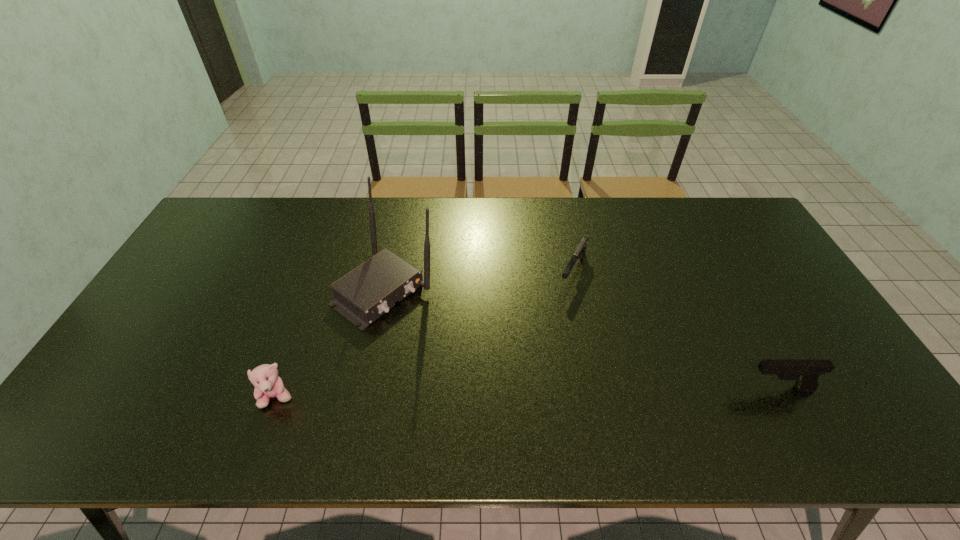
Locate an element on the screen. Image resolution: width=960 pixels, height=540 pixels. vacant space located on the back of the tallest object to connect cables is located at coordinates (468, 349).

You are a GUI agent. You are given a task and a screenshot of the screen. Output one action in this format:
    pyautogui.click(x=<x>, y=<y>)
    Task: Click on the free space located 0.170m on the back of the tallest object to connect cables
    The height and width of the screenshot is (540, 960).
    Given the screenshot: What is the action you would take?
    pyautogui.click(x=467, y=347)

Where is `vacant space located 0.110m at the muzzle end of the gun`? This screenshot has width=960, height=540. vacant space located 0.110m at the muzzle end of the gun is located at coordinates (556, 315).

You are a GUI agent. You are given a task and a screenshot of the screen. Output one action in this format:
    pyautogui.click(x=<x>, y=<y>)
    Task: Click on the vacant region located at the muzzle end of the gun
    Image resolution: width=960 pixels, height=540 pixels.
    Given the screenshot: What is the action you would take?
    pyautogui.click(x=549, y=328)

This screenshot has width=960, height=540. I want to click on vacant space located at the muzzle end of the gun, so click(525, 375).

Locate an element on the screen. teddy bear at the near edge is located at coordinates (268, 384).

Where is `pistol that is at the near edge`? This screenshot has width=960, height=540. pistol that is at the near edge is located at coordinates click(x=806, y=372).

Find the location of a particular element. Image resolution: width=960 pixels, height=540 pixels. object present at the right edge is located at coordinates (x=806, y=372).

This screenshot has height=540, width=960. Find the location of `object that is at the near right corner`. object that is at the near right corner is located at coordinates (806, 372).

At what (x,y) coordinates should I click in order to perform the action: click on vacant region at the far edge. Please return your answer as a coordinate pair (x, y). Image resolution: width=960 pixels, height=540 pixels. Looking at the image, I should click on (540, 233).